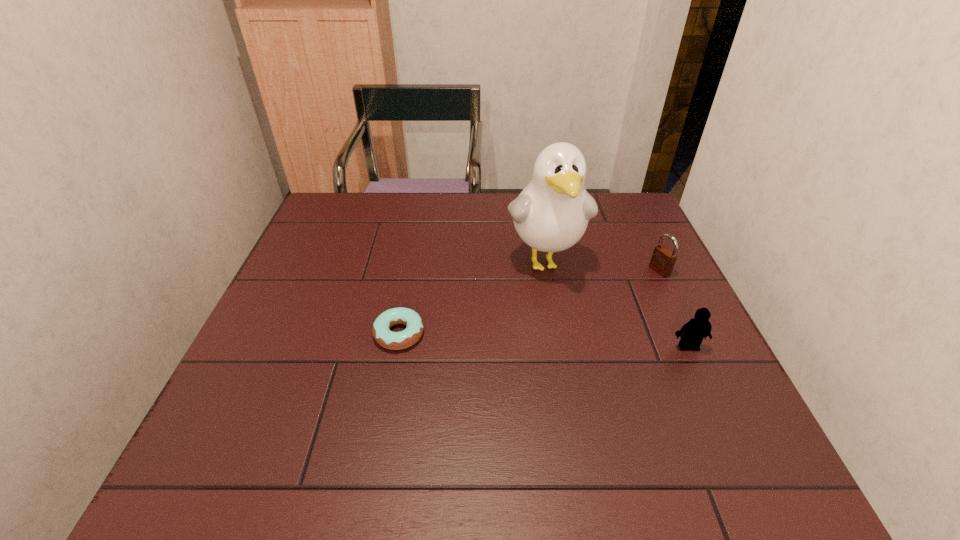
Locate an element on the screen. The height and width of the screenshot is (540, 960). vacant space at the right edge of the desktop is located at coordinates (608, 235).

In the image, there is a desktop. Identify the location of free space at the far left corner. This screenshot has height=540, width=960. (312, 224).

Locate an element on the screen. The image size is (960, 540). vacant space at the near left corner of the desktop is located at coordinates (218, 426).

In the image, there is a desktop. Where is `vacant space at the near right corner`? The width and height of the screenshot is (960, 540). vacant space at the near right corner is located at coordinates (721, 414).

Find the location of a particular element. vacant space in between the leftmost object and the padlock is located at coordinates (529, 302).

This screenshot has width=960, height=540. I want to click on vacant space in between the tallest object and the leftmost object, so click(472, 298).

This screenshot has height=540, width=960. What are the coordinates of `free space between the doughnut and the gull` in the screenshot? It's located at (472, 298).

Where is `free spot between the leftmost object and the Lego`? This screenshot has height=540, width=960. free spot between the leftmost object and the Lego is located at coordinates (543, 340).

This screenshot has height=540, width=960. Identify the location of free space between the gull and the Lego. point(616,304).

The width and height of the screenshot is (960, 540). I want to click on unoccupied area between the Lego and the tallest object, so click(x=616, y=304).